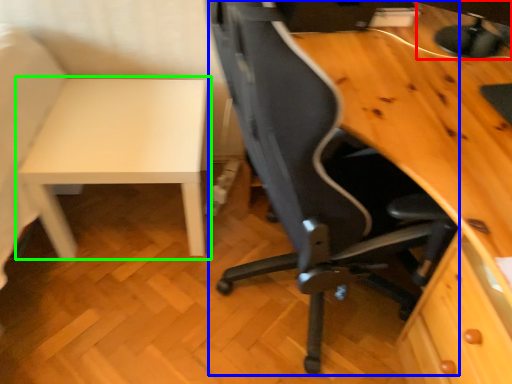
Question: Estimate the real-world distances between objects in this image. Which object is farther from computer monitor (highlighted by a red box), chair (highlighted by a blue box) or table (highlighted by a green box)?

Choices:
 (A) chair
 (B) table

Answer: (B)